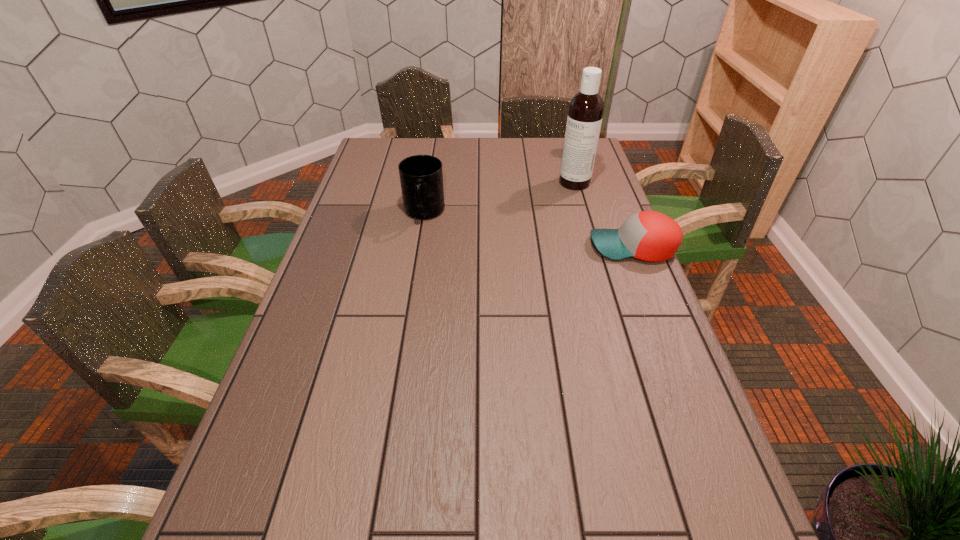
Where is `vacant space on the desktop that is between the mug and the baseball cap and is positioned on the label side of the tallest object`? This screenshot has width=960, height=540. vacant space on the desktop that is between the mug and the baseball cap and is positioned on the label side of the tallest object is located at coordinates (514, 227).